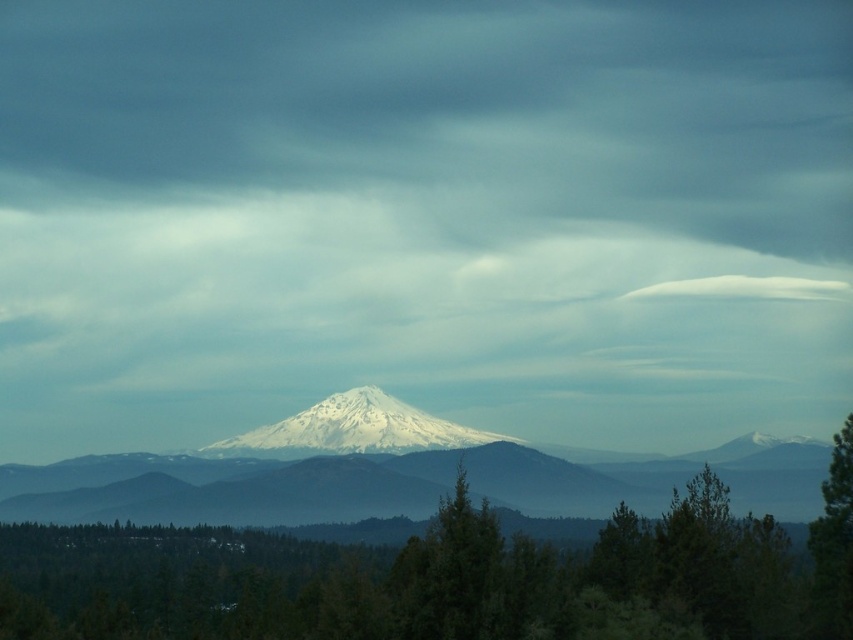
Measure the distance from snowy peak at center to green matte tree at right.

snowy peak at center is 258.01 meters away from green matte tree at right.

Is snowy peak at center to the left of green matte tree at right from the viewer's perspective?

Yes, snowy peak at center is to the left of green matte tree at right.

Does point (358, 448) come closer to viewer compared to point (842, 424)?

No, (358, 448) is behind (842, 424).

The width and height of the screenshot is (853, 640). I want to click on snowy peak at center, so pyautogui.click(x=352, y=429).

In the scene shown: Between green matte tree at center and snowy peak at center, which one appears on the left side from the viewer's perspective?

Positioned to the left is snowy peak at center.

Where is `green matte tree at center`? green matte tree at center is located at coordinates (440, 580).

From the picture: Is green matte tree at center wider than green matte tree at right?

Yes, green matte tree at center is wider than green matte tree at right.

Who is higher up, green matte tree at center or green matte tree at right?

green matte tree at right is higher up.

Who is more forward, [412,600] or [821,493]?

Point [412,600]

The image size is (853, 640). I want to click on green matte tree at center, so click(440, 580).